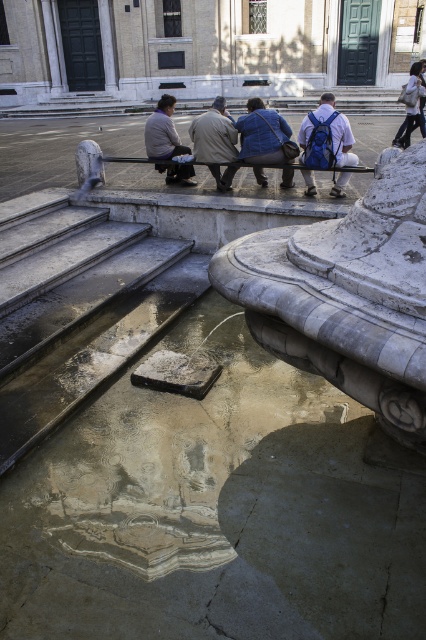
You are standing in the city square and see the white marble fountain at center and the khaki cotton pants at center. Which object is positioned to the right of the other?

The white marble fountain at center is to the right of the khaki cotton pants at center.

You are standing in front of the stone fountain and see both the denim jacket at center and the matte blue backpack at center. Which object is closer to you?

The denim jacket at center is closer to you because it is further to the viewer than the matte blue backpack at center.

You are standing in front of the stone fountain and see the denim jacket at center and the khaki cotton pants at center. Which item is positioned to the right side?

The denim jacket at center is positioned to the right of the khaki cotton pants at center.